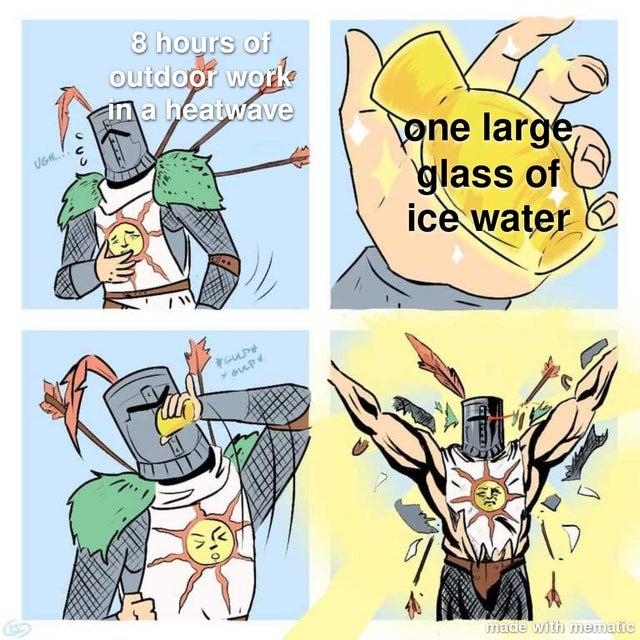
At what (x,y) coordinates should I click in order to perform the action: click on eye hole. Please return your answer as a coordinate pair (x, y). The image size is (640, 640). Looking at the image, I should click on (483, 417), (475, 417), (486, 418), (148, 404), (163, 403), (163, 395), (125, 134), (111, 130), (102, 137).